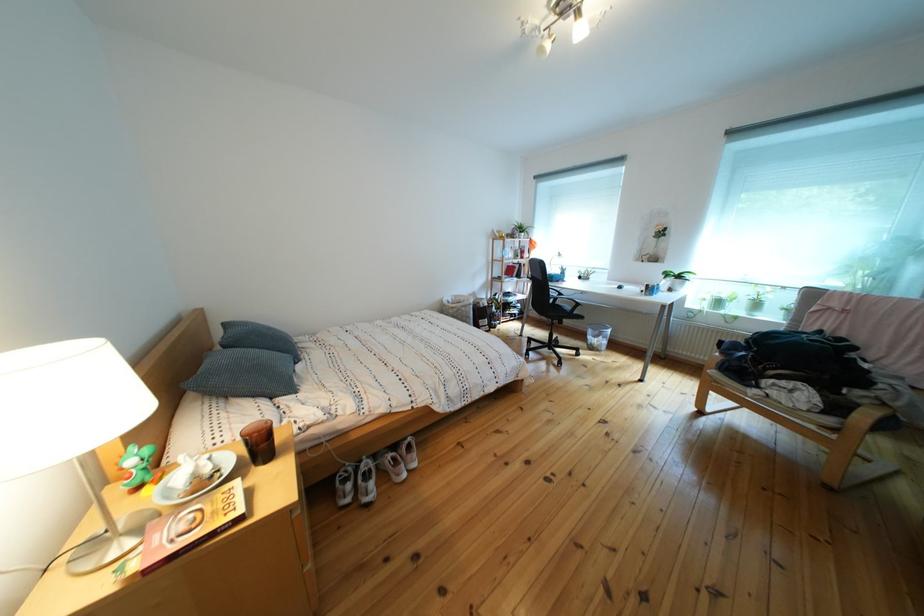
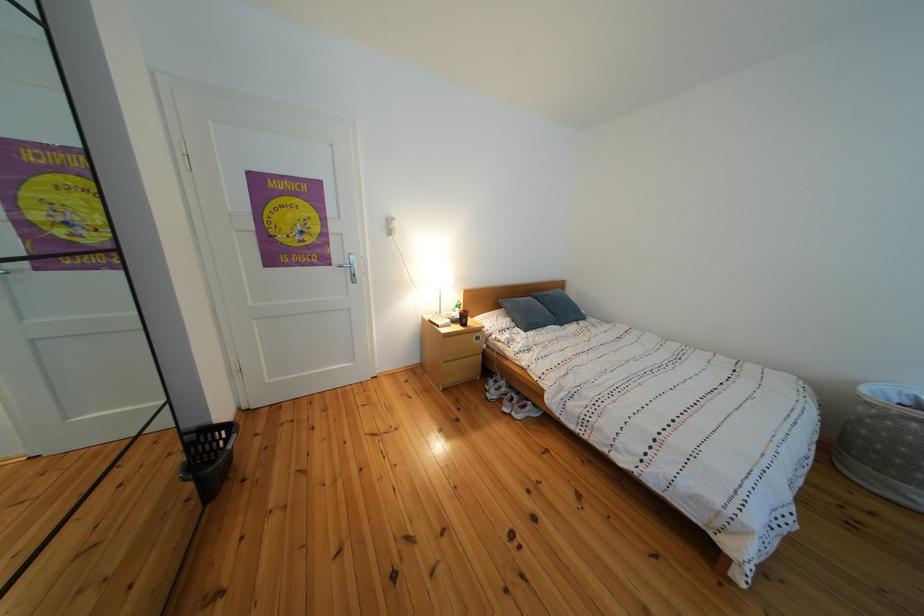
Find the pixel in the second image that matches pixel 457 309 in the first image.

(890, 398)